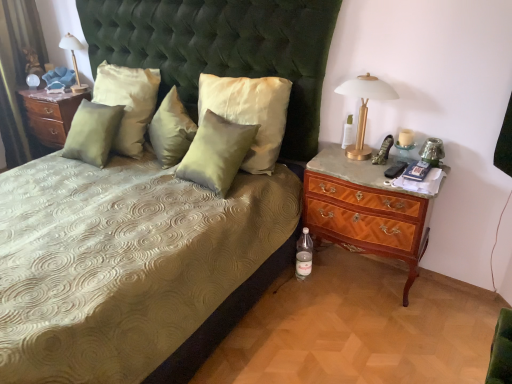
Find the location of `vacant area situated below mahogany wood nightstand at right, the second nightstand from the left (from a real-world perspective)`. vacant area situated below mahogany wood nightstand at right, the second nightstand from the left (from a real-world perspective) is located at coordinates (365, 277).